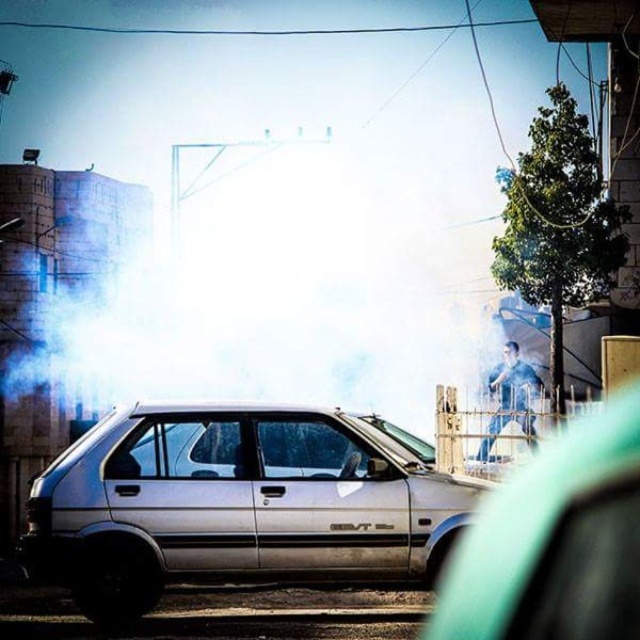
Where is `white foggy smoke at center`? white foggy smoke at center is located at coordinates (x=244, y=282).

Consider the image. Does white foggy smoke at center have a greater width compared to white matte hatchback at center?

Indeed, white foggy smoke at center has a greater width compared to white matte hatchback at center.

Does point (170, 276) lie in front of point (513, 609)?

No, it is not.

In order to click on white foggy smoke at center in this screenshot , I will do `click(244, 282)`.

How much distance is there between silver metallic hatchback at center and blue denim jeans at center?

A distance of 7.77 meters exists between silver metallic hatchback at center and blue denim jeans at center.

Between silver metallic hatchback at center and blue denim jeans at center, which one has less height?

Standing shorter between the two is blue denim jeans at center.

What do you see at coordinates (237, 504) in the screenshot? The image size is (640, 640). I see `silver metallic hatchback at center` at bounding box center [237, 504].

Locate an element on the screen. The height and width of the screenshot is (640, 640). silver metallic hatchback at center is located at coordinates (237, 504).

Is white foggy smoke at center above blue denim jeans at center?

Indeed, white foggy smoke at center is positioned over blue denim jeans at center.

Between white foggy smoke at center and blue denim jeans at center, which one has more height?

With more height is white foggy smoke at center.

Is point (72, 285) behind point (484, 440)?

Yes, it is.

Locate an element on the screen. white foggy smoke at center is located at coordinates (244, 282).